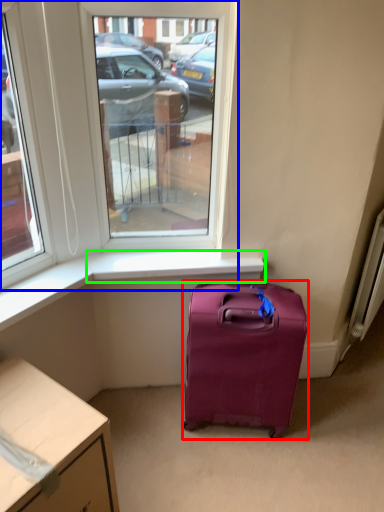
Question: Based on their relative distances, which object is farther from luggage and bags (highlighted by a red box)? Choose from window (highlighted by a blue box) and window sill (highlighted by a green box).

Choices:
 (A) window
 (B) window sill

Answer: (A)